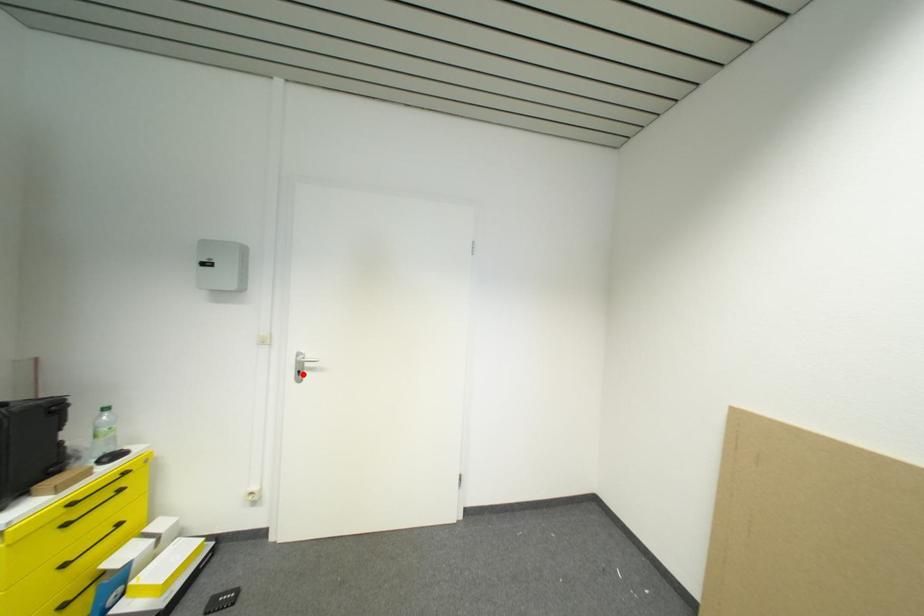
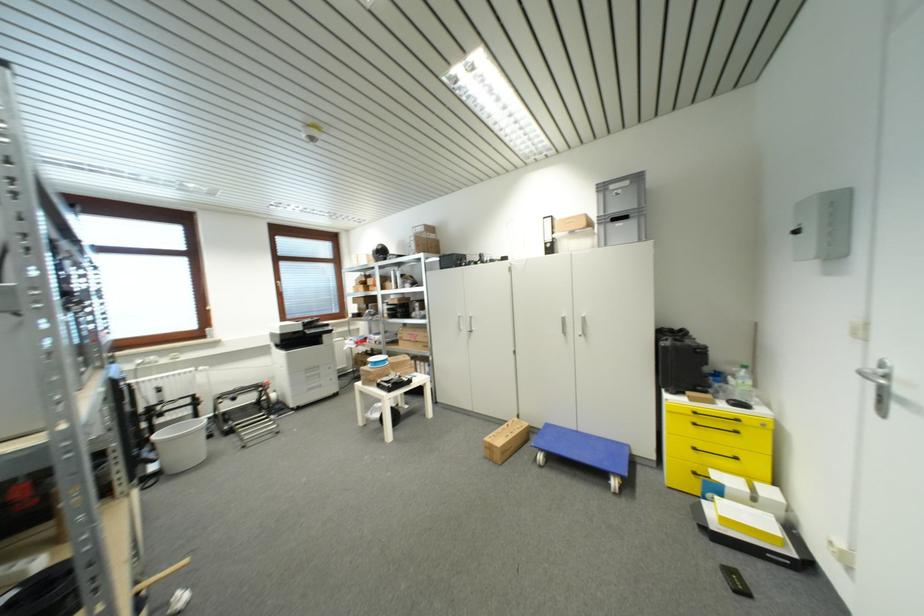
Question: I am providing you with two images of the same scene from different viewpoints. A red point is marked on the first image. Is the red point's position out of view in image 2?

Choices:
 (A) Yes
 (B) No

Answer: (B)